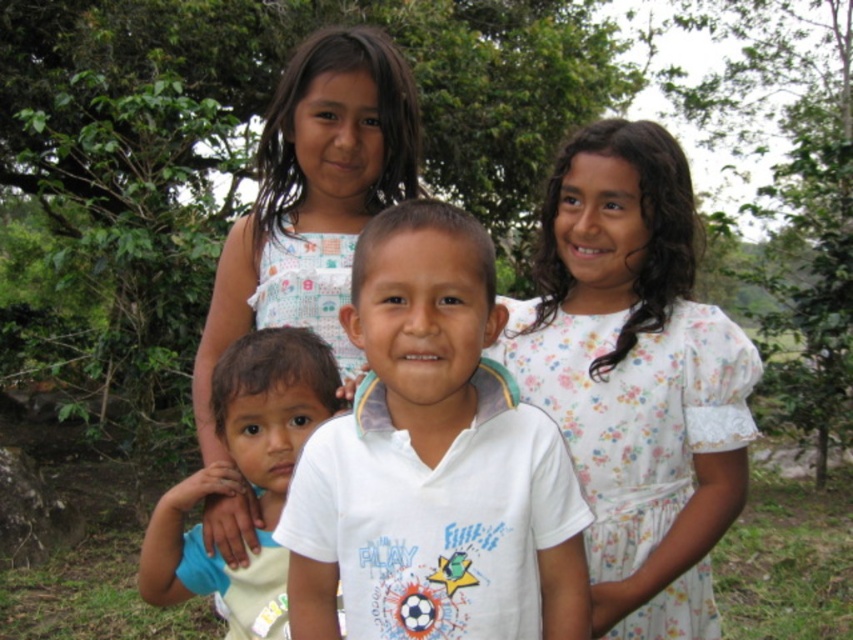
Question: Which object is closer to the camera taking this photo?

Choices:
 (A) floral cotton dress at upper right
 (B) light brown skin at center
 (C) white floral dress at upper center

Answer: (A)

Question: Is floral cotton dress at upper right smaller than light brown skin at center?

Choices:
 (A) yes
 (B) no

Answer: (B)

Question: Considering the real-world distances, which object is farthest from the white cotton shirt at center?

Choices:
 (A) white floral dress at upper center
 (B) floral cotton dress at upper right
 (C) light brown skin at center

Answer: (A)

Question: Can you confirm if white floral dress at upper center is bigger than light brown skin at center?

Choices:
 (A) yes
 (B) no

Answer: (A)

Question: Which object appears farthest from the camera in this image?

Choices:
 (A) floral cotton dress at upper right
 (B) white floral dress at upper center

Answer: (B)

Question: Can you confirm if floral cotton dress at upper right is smaller than white floral dress at upper center?

Choices:
 (A) no
 (B) yes

Answer: (B)